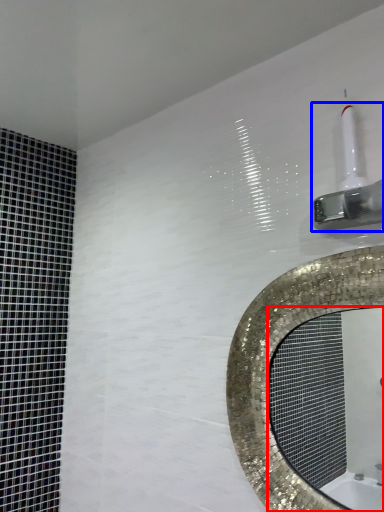
Question: Which of the following is the closest to the observer, mirror (highlighted by a red box) or shower (highlighted by a blue box)?

Choices:
 (A) mirror
 (B) shower

Answer: (B)